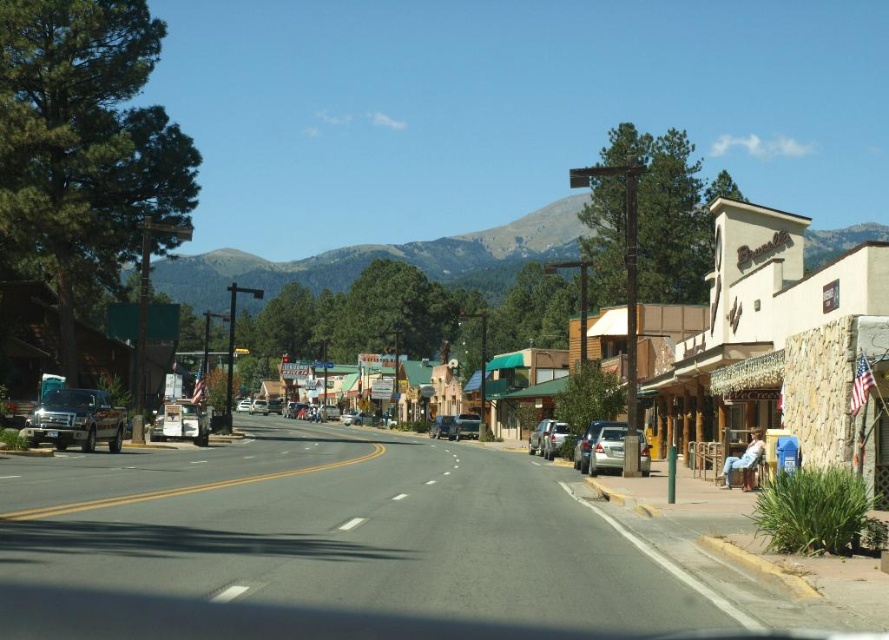
Question: Does silver metallic truck at left have a smaller size compared to silver metallic sedan at center-right?

Choices:
 (A) yes
 (B) no

Answer: (A)

Question: Can you confirm if stone building at center is positioned below satin silver sedan at right?

Choices:
 (A) no
 (B) yes

Answer: (A)

Question: Which object is closer to the camera taking this photo?

Choices:
 (A) metallic silver sedan at center-right
 (B) metallic silver sedan at center
 (C) silver metallic truck at left

Answer: (C)

Question: Which point is closer to the camera?

Choices:
 (A) (815, 310)
 (B) (545, 438)
 (C) (342, 284)

Answer: (A)

Question: Which object is closer to the camera taking this photo?

Choices:
 (A) satin silver sedan at right
 (B) silver metallic sedan at center
 (C) stone building at center
 (D) silver metallic truck at left

Answer: (C)

Question: Is metallic silver sedan at center-right positioned at the back of silver metallic sedan at center-right?

Choices:
 (A) yes
 (B) no

Answer: (B)